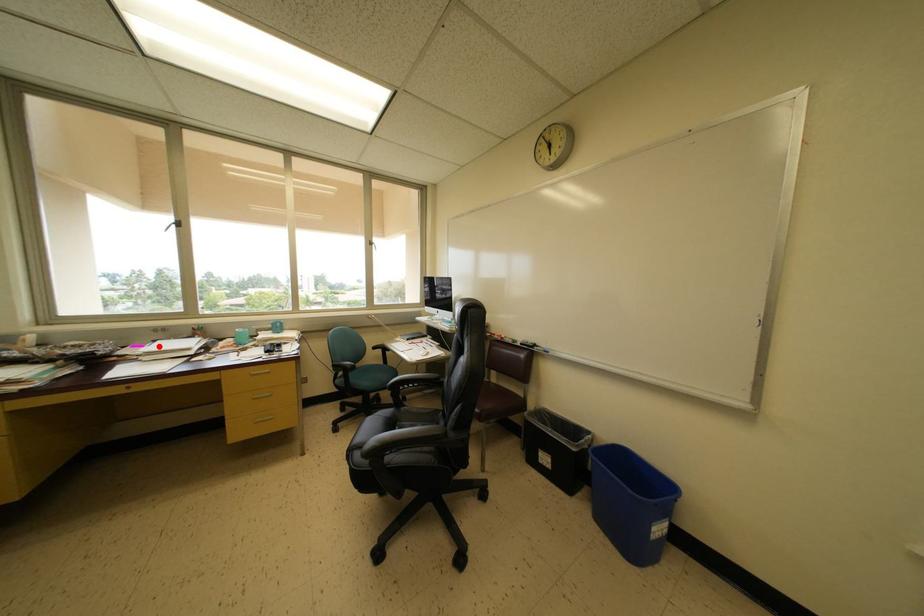
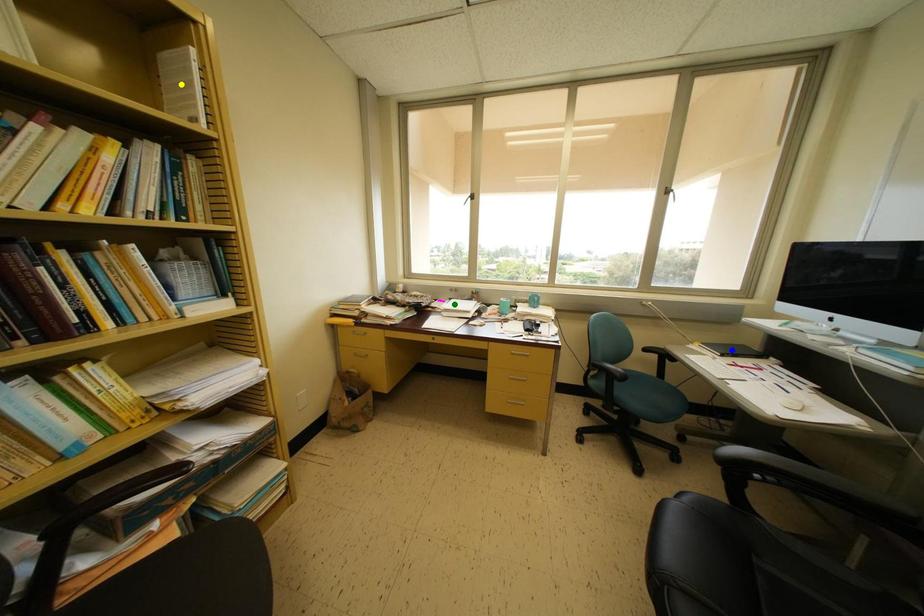
Question: I am providing you with two images of the same scene from different viewpoints. A red point is marked on the first image. You are given multiple points on the second image. Which point in image 2 represents the same 3d spot as the red point in image 1?

Choices:
 (A) blue point
 (B) yellow point
 (C) green point

Answer: (C)